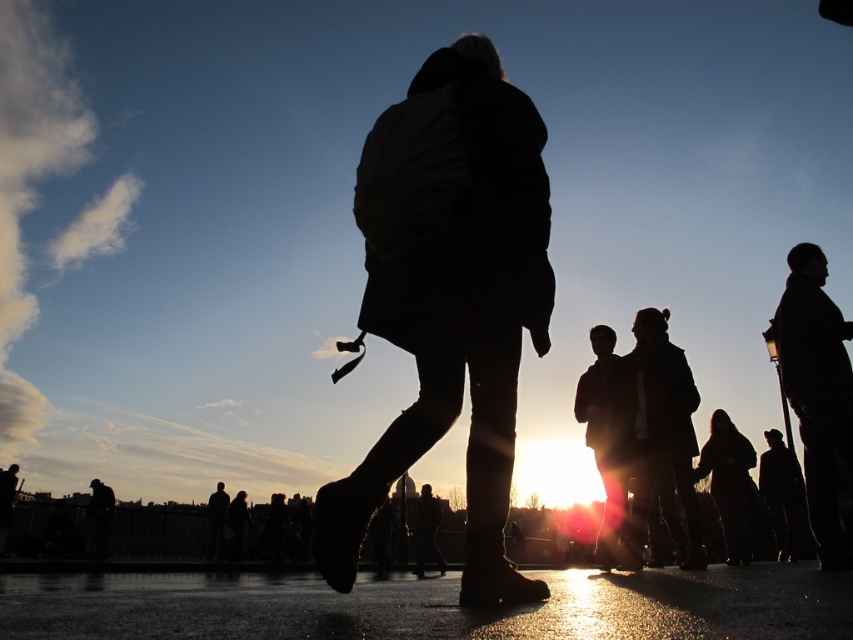
Question: Does black matte coat at center appear on the left side of black matte jacket at upper right?

Choices:
 (A) yes
 (B) no

Answer: (A)

Question: Does black matte coat at center have a larger size compared to black matte jacket at upper right?

Choices:
 (A) yes
 (B) no

Answer: (B)

Question: Can you confirm if black matte coat at center is bigger than black matte jacket at upper right?

Choices:
 (A) no
 (B) yes

Answer: (A)

Question: Which of the following is the closest to the observer?

Choices:
 (A) black matte coat at center
 (B) black matte jacket at upper right

Answer: (A)

Question: Which point appears closest to the camera in this image?

Choices:
 (A) (492, 316)
 (B) (810, 420)

Answer: (A)